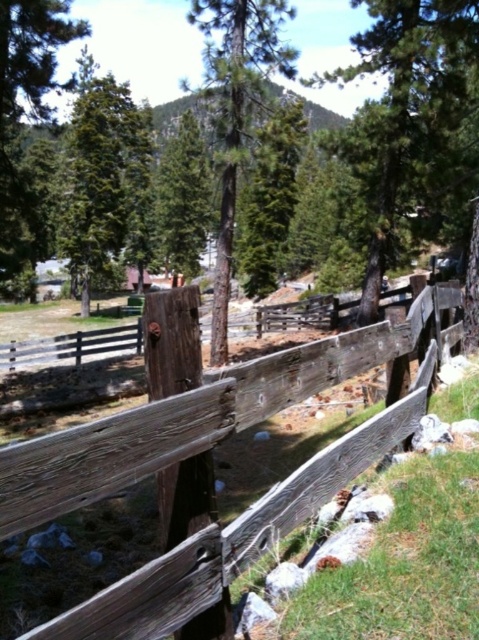
Who is lower down, green matte tree at upper left or smooth brown tree at center?

smooth brown tree at center is lower down.

Is green matte tree at upper left below smooth brown tree at center?

Actually, green matte tree at upper left is above smooth brown tree at center.

Is point (136, 115) positioned after point (216, 49)?

Yes.

This screenshot has width=479, height=640. Identify the location of green matte tree at upper left. (104, 179).

From the picture: Between green rough bark tree at left and smooth brown tree at center, which one is positioned lower?

green rough bark tree at left is below.

Who is positioned more to the right, green rough bark tree at left or smooth brown tree at center?

smooth brown tree at center

Does point (68, 88) come farther from viewer compared to point (285, 67)?

No, it is not.

You are a GUI agent. You are given a task and a screenshot of the screen. Output one action in this format:
    pyautogui.click(x=<x>, y=<y>)
    Task: Click on the green rough bark tree at left
    This screenshot has width=479, height=640.
    Given the screenshot: What is the action you would take?
    pyautogui.click(x=30, y=115)

Between green textured tree at center and smooth brown tree at center, which one is positioned higher?

smooth brown tree at center

Does green textured tree at center appear on the right side of smooth brown tree at center?

Correct, you'll find green textured tree at center to the right of smooth brown tree at center.

The height and width of the screenshot is (640, 479). What do you see at coordinates (413, 122) in the screenshot?
I see `green textured tree at center` at bounding box center [413, 122].

The image size is (479, 640). I want to click on green textured tree at center, so click(413, 122).